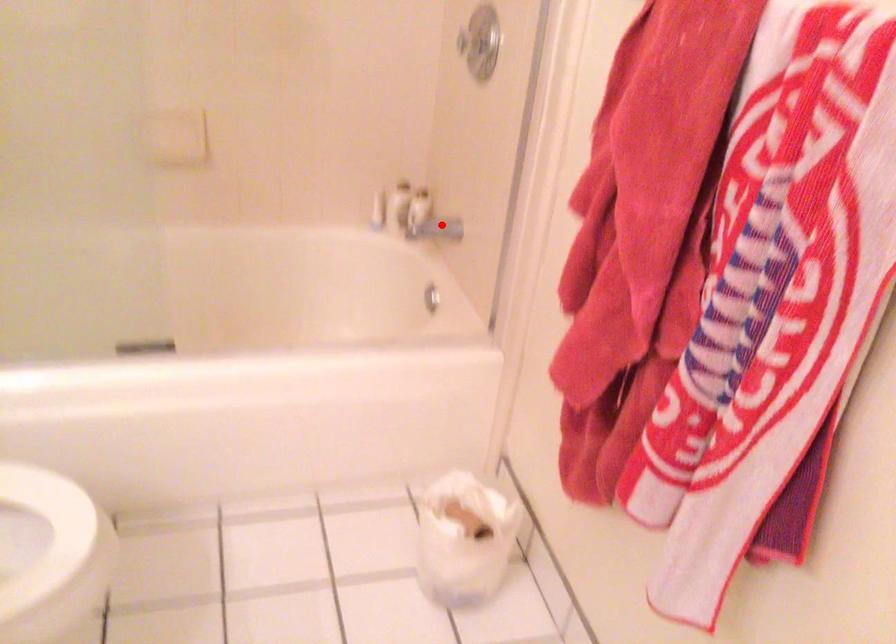
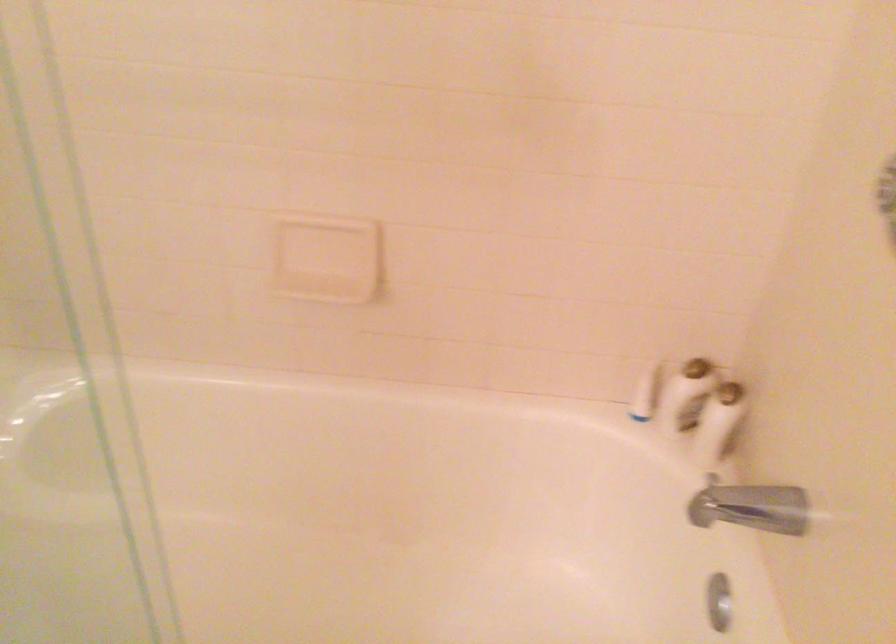
The point at the highlighted location is marked in the first image. Where is the corresponding point in the second image?

(757, 507)